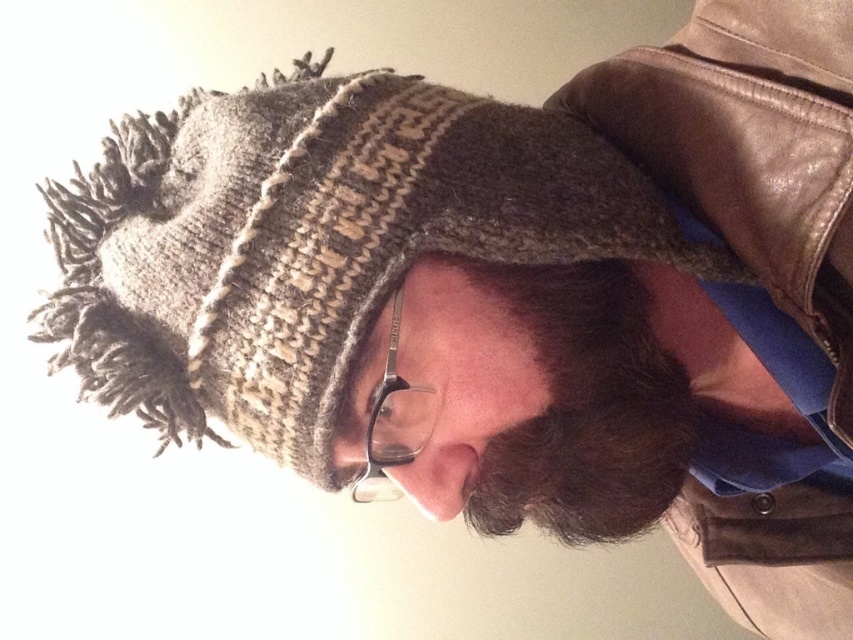
Question: Among these points, which one is nearest to the camera?

Choices:
 (A) (561, 420)
 (B) (659, 241)

Answer: (B)

Question: Is fuzzy knit hat at upper center thinner than dark brown fuzzy beard at center?

Choices:
 (A) yes
 (B) no

Answer: (B)

Question: From the image, what is the correct spatial relationship of fuzzy knit hat at upper center in relation to dark brown fuzzy beard at center?

Choices:
 (A) below
 (B) above

Answer: (B)

Question: Among these objects, which one is nearest to the camera?

Choices:
 (A) dark brown fuzzy beard at center
 (B) fuzzy knit hat at upper center

Answer: (B)

Question: Is fuzzy knit hat at upper center below dark brown fuzzy beard at center?

Choices:
 (A) yes
 (B) no

Answer: (B)